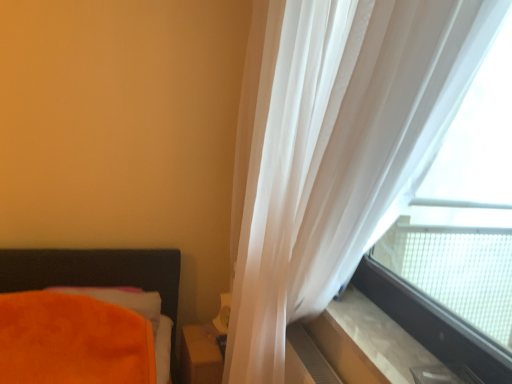
Question: Is translucent fabric at upper right next to matte brown wooden table at lower center?

Choices:
 (A) yes
 (B) no

Answer: (B)

Question: From the image's perspective, is translucent fabric at upper right on matte brown wooden table at lower center?

Choices:
 (A) no
 (B) yes

Answer: (B)

Question: Does translucent fabric at upper right come in front of matte brown wooden table at lower center?

Choices:
 (A) yes
 (B) no

Answer: (A)

Question: Does translucent fabric at upper right have a lesser width compared to matte brown wooden table at lower center?

Choices:
 (A) no
 (B) yes

Answer: (B)

Question: Is translucent fabric at upper right to the right of matte brown wooden table at lower center from the viewer's perspective?

Choices:
 (A) no
 (B) yes

Answer: (B)

Question: Is point (387, 231) positioned closer to the camera than point (212, 332)?

Choices:
 (A) farther
 (B) closer

Answer: (B)

Question: Is translucent fabric at upper right to the left or to the right of matte brown wooden table at lower center in the image?

Choices:
 (A) left
 (B) right

Answer: (B)

Question: Is translucent fabric at upper right wider or thinner than matte brown wooden table at lower center?

Choices:
 (A) thin
 (B) wide

Answer: (A)

Question: Based on their sizes in the image, would you say translucent fabric at upper right is bigger or smaller than matte brown wooden table at lower center?

Choices:
 (A) big
 (B) small

Answer: (A)

Question: From the image's perspective, is translucent fabric at upper right above or below beige marble window sill at lower right?

Choices:
 (A) above
 (B) below

Answer: (A)

Question: From a real-world perspective, relative to beige marble window sill at lower right, is translucent fabric at upper right vertically above or below?

Choices:
 (A) below
 (B) above

Answer: (B)

Question: Considering their positions, is translucent fabric at upper right located in front of or behind beige marble window sill at lower right?

Choices:
 (A) front
 (B) behind

Answer: (A)

Question: Looking at their shapes, would you say translucent fabric at upper right is wider or thinner than beige marble window sill at lower right?

Choices:
 (A) wide
 (B) thin

Answer: (B)

Question: Choose the correct answer: Is orange plush pillow at lower left inside matte brown wooden table at lower center or outside it?

Choices:
 (A) inside
 (B) outside

Answer: (B)

Question: Is orange plush pillow at lower left to the left or to the right of matte brown wooden table at lower center in the image?

Choices:
 (A) left
 (B) right

Answer: (A)